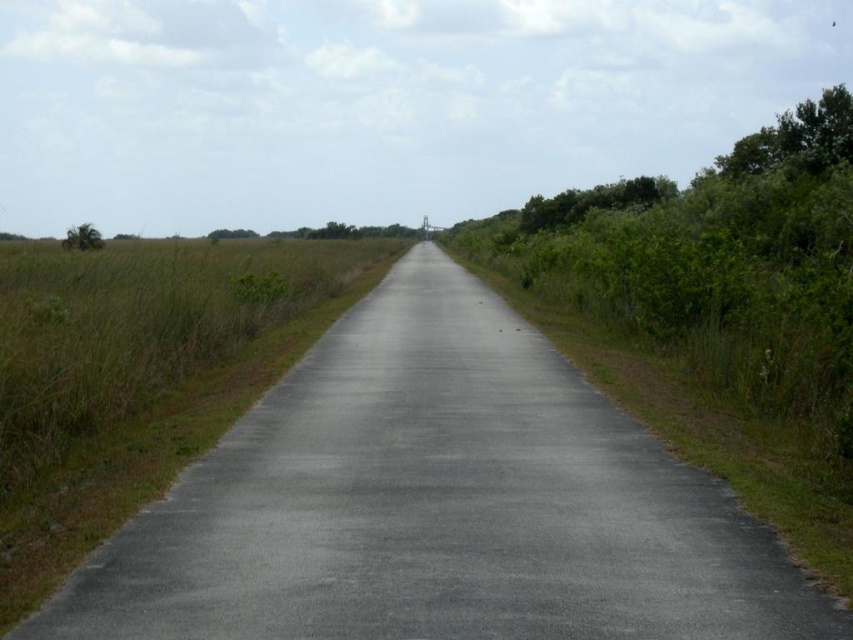
Question: Does gray asphalt road at center appear on the left side of green leafy tree at upper right?

Choices:
 (A) no
 (B) yes

Answer: (B)

Question: Can you confirm if gray asphalt road at center is smaller than green leafy tree at right?

Choices:
 (A) no
 (B) yes

Answer: (B)

Question: Which of the following is the closest to the observer?

Choices:
 (A) green leafy tree at upper right
 (B) green grass at center
 (C) green leafy tree at right
 (D) gray asphalt road at center

Answer: (D)

Question: Which is nearer to the green leafy tree at right?

Choices:
 (A) green leafy tree at upper right
 (B) green leafy tree at left
 (C) gray asphalt road at center

Answer: (A)

Question: In this image, where is green leafy tree at upper right located relative to green leafy tree at right?

Choices:
 (A) right
 (B) left

Answer: (A)

Question: Which point is farther from the camera taking this photo?

Choices:
 (A) (96, 620)
 (B) (91, 541)
 (C) (744, 156)
 (D) (616, 204)

Answer: (D)